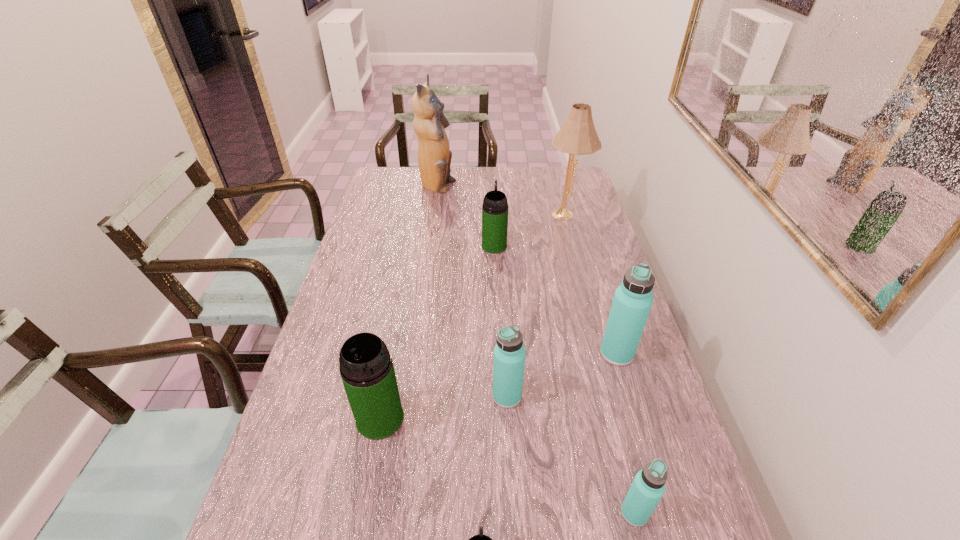
Find the location of a particular element. free space located 0.130m on the left of the leftmost aqua thermos bottle is located at coordinates [440, 396].

Image resolution: width=960 pixels, height=540 pixels. Find the location of `vacant space positioned on the back of the smallest aqua thermos bottle`. vacant space positioned on the back of the smallest aqua thermos bottle is located at coordinates (618, 448).

You are a GUI agent. You are given a task and a screenshot of the screen. Output one action in this format:
    pyautogui.click(x=<x>, y=<y>)
    Task: Click on the object located in the far edge section of the desktop
    This screenshot has width=960, height=540.
    Given the screenshot: What is the action you would take?
    pyautogui.click(x=434, y=156)

Find the location of a particular element. object situated at the left edge is located at coordinates (366, 367).

You are a GUI agent. You are given a task and a screenshot of the screen. Output one action in this format:
    pyautogui.click(x=<x>, y=<y>)
    Task: Click on the lampshade that is at the right edge
    Image resolution: width=960 pixels, height=540 pixels.
    Given the screenshot: What is the action you would take?
    pyautogui.click(x=578, y=136)

Identify the location of vacant space at the left edge of the desktop. (387, 214).

Locate an element on the screen. The image size is (960, 540). free space at the right edge is located at coordinates (588, 205).

Identify the location of free space at the far right corner of the desktop. This screenshot has width=960, height=540. (552, 167).

Find the location of a particular element. The width and height of the screenshot is (960, 540). vacant region between the leftmost aqua thermos bottle and the second nearest object is located at coordinates (570, 455).

The image size is (960, 540). I want to click on free point between the nearest aqua thermos bottle and the cat, so click(536, 350).